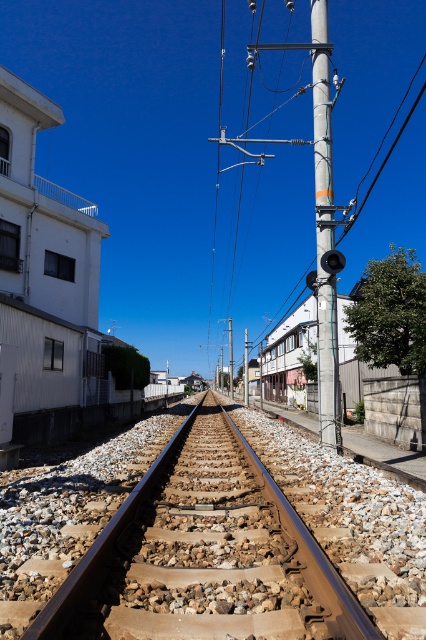
Question: Which object is positioned farthest from the silver metallic pole at center?

Choices:
 (A) brown metal train track at center
 (B) smooth metallic pole at upper center

Answer: (B)

Question: Which object is the closest to the silver metallic pole at center?

Choices:
 (A) brown metal train track at center
 (B) smooth metallic pole at upper center

Answer: (A)

Question: Can you confirm if silver metallic pole at center is wider than smooth metallic pole at upper center?

Choices:
 (A) no
 (B) yes

Answer: (A)

Question: Is brown metal train track at center positioned at the back of smooth metallic pole at upper center?

Choices:
 (A) yes
 (B) no

Answer: (B)

Question: Is brown metal train track at center in front of smooth metallic pole at upper center?

Choices:
 (A) yes
 (B) no

Answer: (A)

Question: Estimate the real-world distances between objects in this image. Which object is closer to the brown metal train track at center?

Choices:
 (A) silver metallic pole at center
 (B) smooth metallic pole at upper center

Answer: (A)